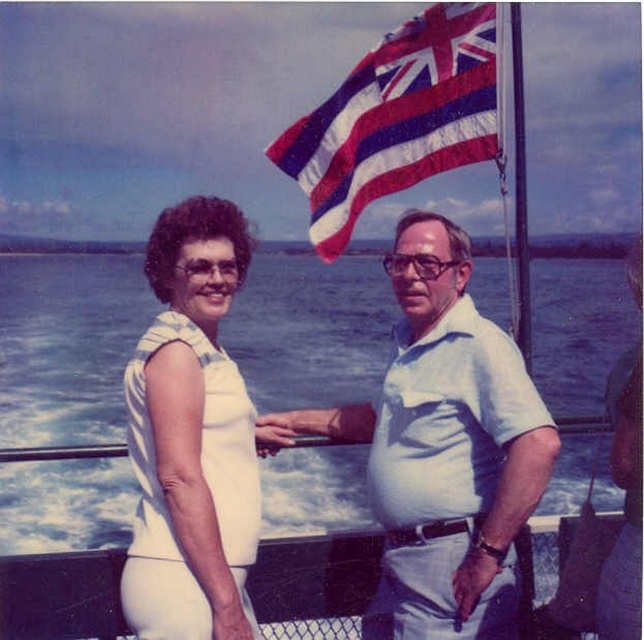
You are a photographer on the boat and want to take a photo of both the blue water at center and the white fabric dress at left in the same frame. Given that your camera has a maximum focus range of 60 meters, will you be able to capture both subjects clearly in one shot?

The blue water at center and white fabric dress at left are 64.89 meters apart. Since the distance exceeds the camera maximum focus range of 60 meters, you cannot capture both subjects clearly in one shot.

You are a photographer on the boat and want to capture a photo of the blue water at center without the textured fabric flag at upper center appearing in the frame. Is this possible based on their positions?

The blue water at center is in front of the textured fabric flag at upper center, so the flag would block the view of the water. Therefore, it is not possible to capture the blue water at center without the flag appearing in the frame.